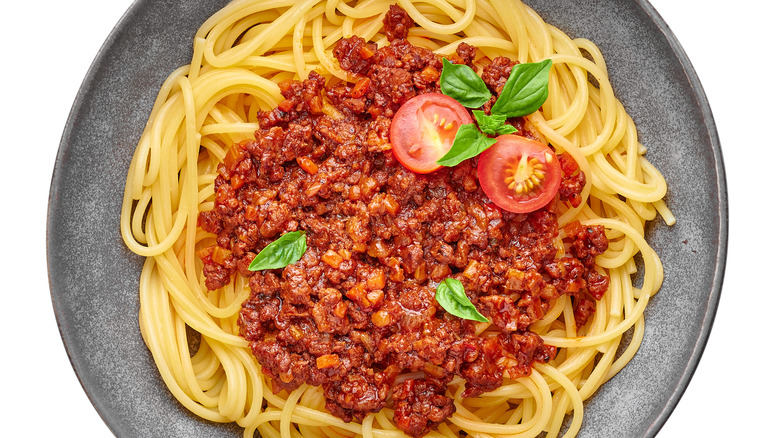
You are a GUI agent. You are given a task and a screenshot of the screen. Output one action in this format:
    pyautogui.click(x=<x>, y=<y>)
    Task: Click on the bowl
    
    Given the screenshot: What is the action you would take?
    pyautogui.click(x=154, y=34), pyautogui.click(x=89, y=218), pyautogui.click(x=675, y=393), pyautogui.click(x=696, y=85)